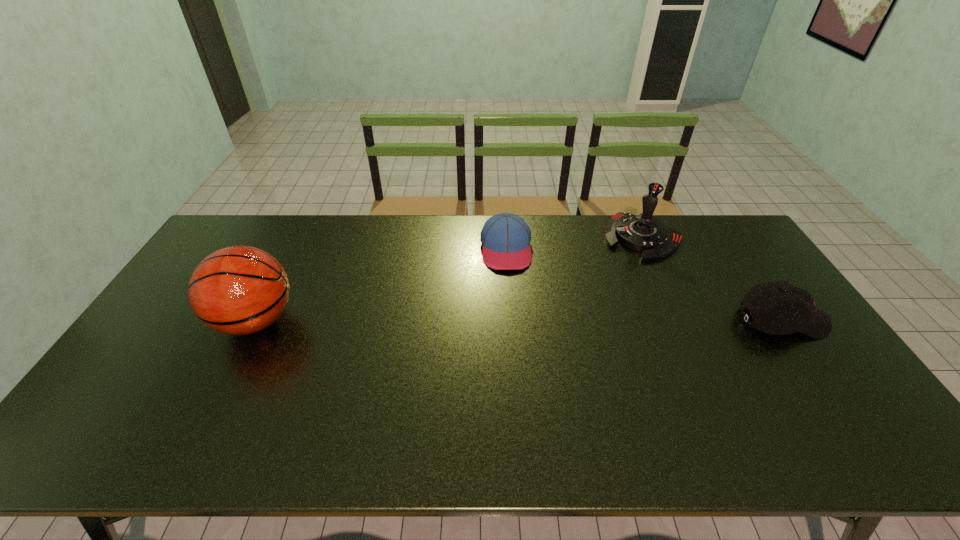
You are a GUI agent. You are given a task and a screenshot of the screen. Output one action in this format:
    pyautogui.click(x=<x>, y=<y>)
    Task: Click on the empty location between the basketball and the rightmost object
    This screenshot has height=540, width=960.
    Given the screenshot: What is the action you would take?
    pyautogui.click(x=519, y=320)

At what (x,y) coordinates should I click in order to perform the action: click on vacant area that lies between the tallest object and the nearer baseball cap. Please return your answer as a coordinate pair (x, y). Looking at the image, I should click on (519, 320).

I want to click on vacant space that's between the leftmost object and the joystick, so click(449, 279).

This screenshot has width=960, height=540. Identify the location of vacant space that's between the second object from right to left and the tallest object. (449, 279).

Identify the location of empty location between the basketball and the second object from right to left. (449, 279).

Select which object appears as the second closest to the right baseball cap. Please provide its 2D coordinates. Your answer should be formatted as a tuple, i.e. [(x, y)], where the tuple contains the x and y coordinates of a point satisfying the conditions above.

[(505, 237)]

Choose which object is the second nearest neighbor to the right baseball cap. Please provide its 2D coordinates. Your answer should be formatted as a tuple, i.e. [(x, y)], where the tuple contains the x and y coordinates of a point satisfying the conditions above.

[(505, 237)]

Where is `vacant space that satisfies the following two spatial constraints: 1. on the front side of the rightmost object; 2. on the front-facing side of the farther baseball cap`? vacant space that satisfies the following two spatial constraints: 1. on the front side of the rightmost object; 2. on the front-facing side of the farther baseball cap is located at coordinates (511, 320).

Locate an element on the screen. This screenshot has width=960, height=540. vacant region that satisfies the following two spatial constraints: 1. on the front side of the farther baseball cap; 2. on the front-facing side of the rightmost object is located at coordinates (511, 320).